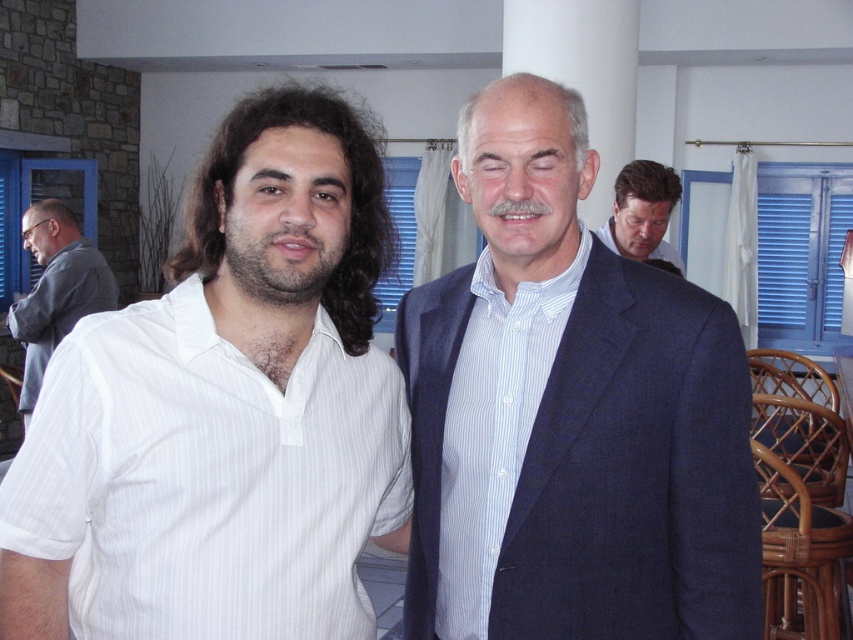
You are an interior designer planning to hang a painting on the wall in this room. The painting is 30 cm wide and needs to be placed exactly where the white striped shirt at center is currently located. Is there enough space on the wall to accommodate the painting?

The white striped shirt at center is located at point (492, 429). Since the coordinates indicate the position on the wall, and the painting is only 30 cm wide, there should be sufficient space to hang it there.

You are a photographer setting up for a group photo. You see the white striped shirt at center and the blue suit at upper right. Which person should you position to your left to align with their current positions?

You should position the person wearing the white striped shirt at center to your left since it is already to the left of the blue suit at upper right in the current setup.